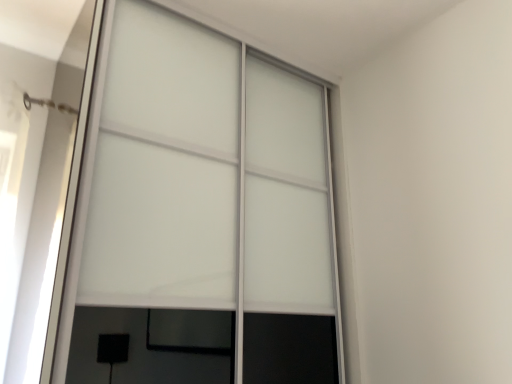
What do you see at coordinates (202, 179) in the screenshot? The height and width of the screenshot is (384, 512). I see `frosted glass door at center` at bounding box center [202, 179].

You are a GUI agent. You are given a task and a screenshot of the screen. Output one action in this format:
    pyautogui.click(x=<x>, y=<y>)
    Task: Click on the frosted glass door at center
    The height and width of the screenshot is (384, 512).
    Given the screenshot: What is the action you would take?
    pyautogui.click(x=202, y=179)

Locate an element on the screen. frosted glass door at center is located at coordinates (202, 179).